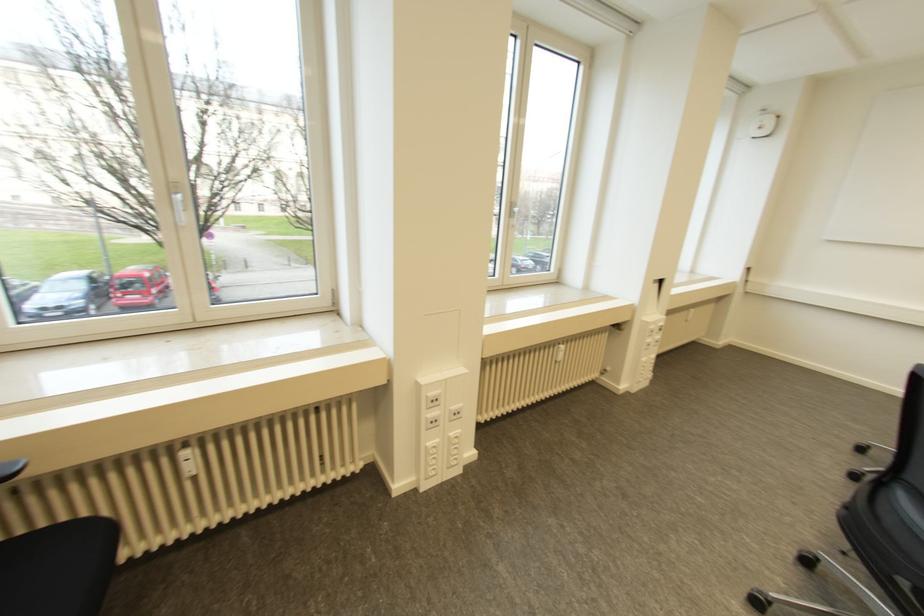
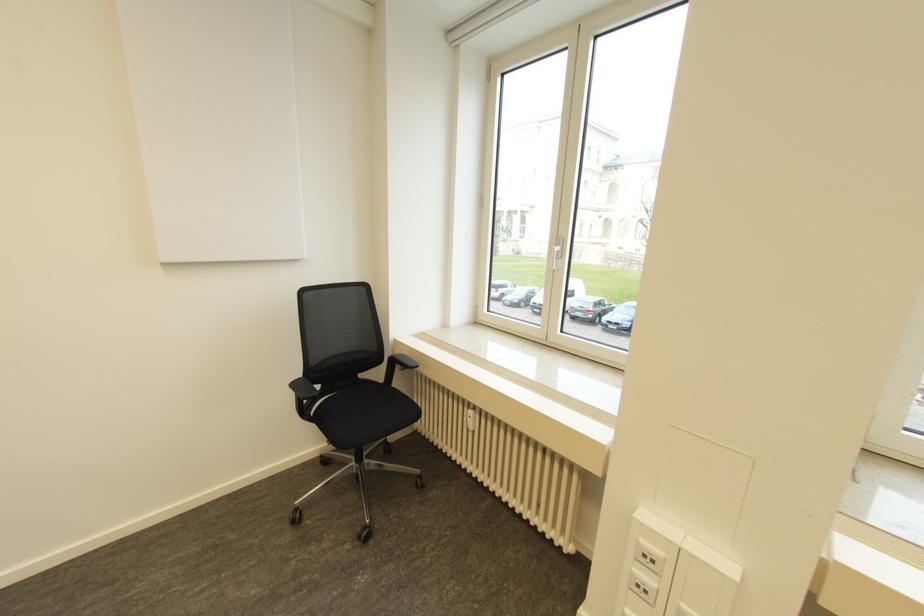
In the second image, find the point that corresponds to point (185, 453) in the first image.

(469, 411)